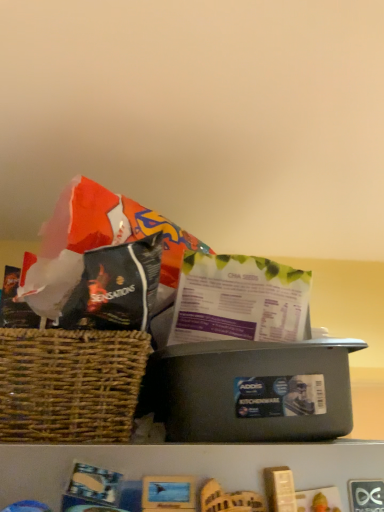
Question: Is green paper gift bag at center oriented away from matte black plastic container at center?

Choices:
 (A) no
 (B) yes

Answer: (A)

Question: Considering the relative sizes of green paper gift bag at center and matte black plastic container at center in the image provided, is green paper gift bag at center bigger than matte black plastic container at center?

Choices:
 (A) yes
 (B) no

Answer: (B)

Question: From the image's perspective, is green paper gift bag at center below matte black plastic container at center?

Choices:
 (A) no
 (B) yes

Answer: (A)

Question: Can you confirm if green paper gift bag at center is wider than matte black plastic container at center?

Choices:
 (A) no
 (B) yes

Answer: (A)

Question: Can you confirm if green paper gift bag at center is thinner than matte black plastic container at center?

Choices:
 (A) no
 (B) yes

Answer: (B)

Question: Can you confirm if green paper gift bag at center is taller than matte black plastic container at center?

Choices:
 (A) yes
 (B) no

Answer: (B)

Question: From the image's perspective, is matte black plastic container at center under green paper gift bag at center?

Choices:
 (A) no
 (B) yes

Answer: (B)

Question: Is the position of matte black plastic container at center more distant than that of green paper gift bag at center?

Choices:
 (A) yes
 (B) no

Answer: (B)

Question: Is matte black plastic container at center smaller than green paper gift bag at center?

Choices:
 (A) yes
 (B) no

Answer: (B)

Question: Does matte black plastic container at center have a greater height compared to green paper gift bag at center?

Choices:
 (A) no
 (B) yes

Answer: (B)

Question: From a real-world perspective, is matte black plastic container at center on green paper gift bag at center?

Choices:
 (A) no
 (B) yes

Answer: (A)

Question: Is matte black plastic container at center located outside green paper gift bag at center?

Choices:
 (A) yes
 (B) no

Answer: (A)

Question: Is green paper gift bag at center taller or shorter than matte black plastic container at center?

Choices:
 (A) tall
 (B) short

Answer: (B)